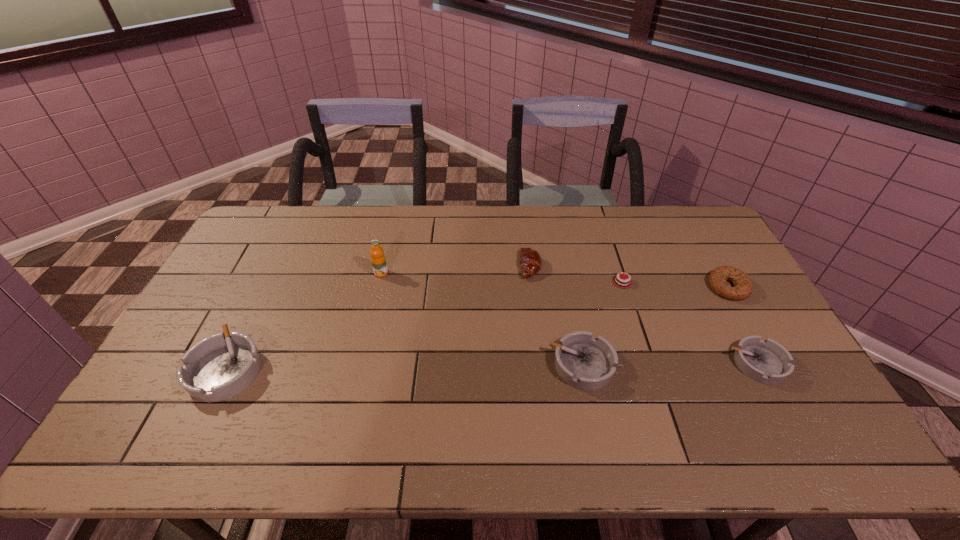
Locate an element on the screen. The image size is (960, 540). free space located 0.150m on the right of the second tallest ashtray is located at coordinates (669, 365).

Find the location of a particular element. This screenshot has height=540, width=960. vacant space situated on the left of the shortest ashtray is located at coordinates (641, 364).

Where is `vacant space located 0.110m on the label of the orange juice`? This screenshot has height=540, width=960. vacant space located 0.110m on the label of the orange juice is located at coordinates (374, 303).

In order to click on free space located 0.290m on the right of the crescent roll in this screenshot , I will do `click(627, 266)`.

At what (x,y) coordinates should I click in order to perform the action: click on vacant space located 0.350m on the back of the fifth object from left to right. Please return your answer as a coordinate pair (x, y). Looking at the image, I should click on (597, 206).

This screenshot has height=540, width=960. I want to click on free space located 0.300m on the front of the bagel, so click(x=785, y=387).

This screenshot has width=960, height=540. In order to click on object located at the left edge in this screenshot , I will do `click(220, 366)`.

I want to click on ashtray situated at the right edge, so click(x=766, y=361).

Identify the location of bagel that is at the right edge. (743, 288).

This screenshot has height=540, width=960. What are the coordinates of `object present at the near left corner` in the screenshot? It's located at (220, 366).